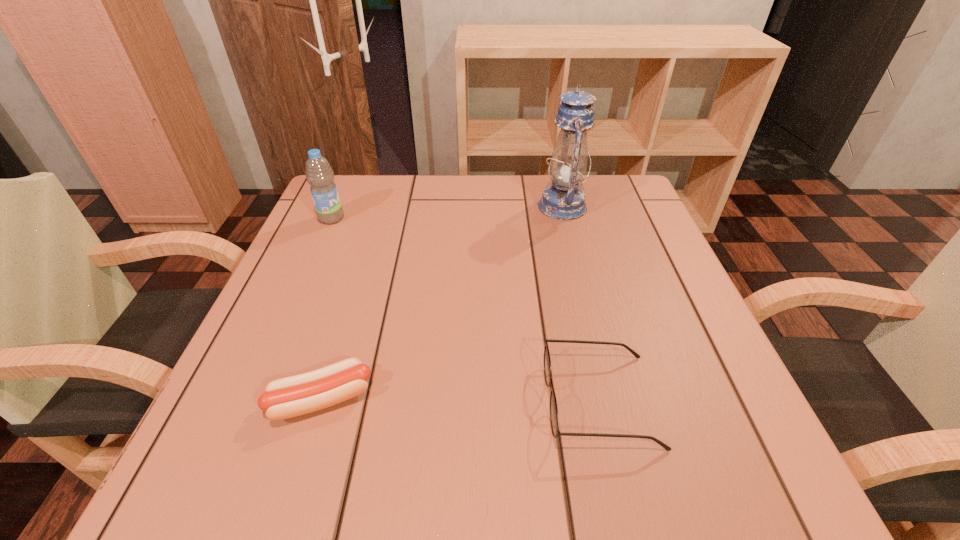
Identify the location of free space that satisfies the following two spatial constraints: 1. on the front-facing side of the lantern; 2. on the front side of the water bottle. (565, 219).